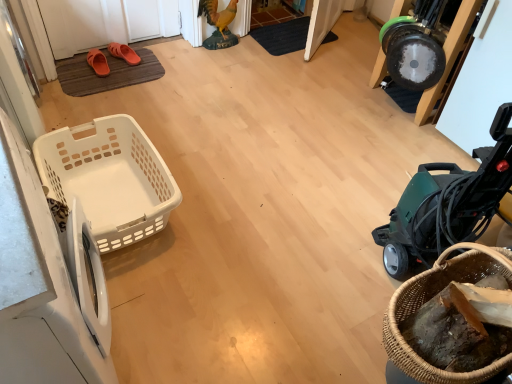
Identify the location of vacant space that's between green plastic vacuum cleaner at right and brown rubber doormat at upper left, marked as the second doormat in a back-to-front arrangement. (234, 155).